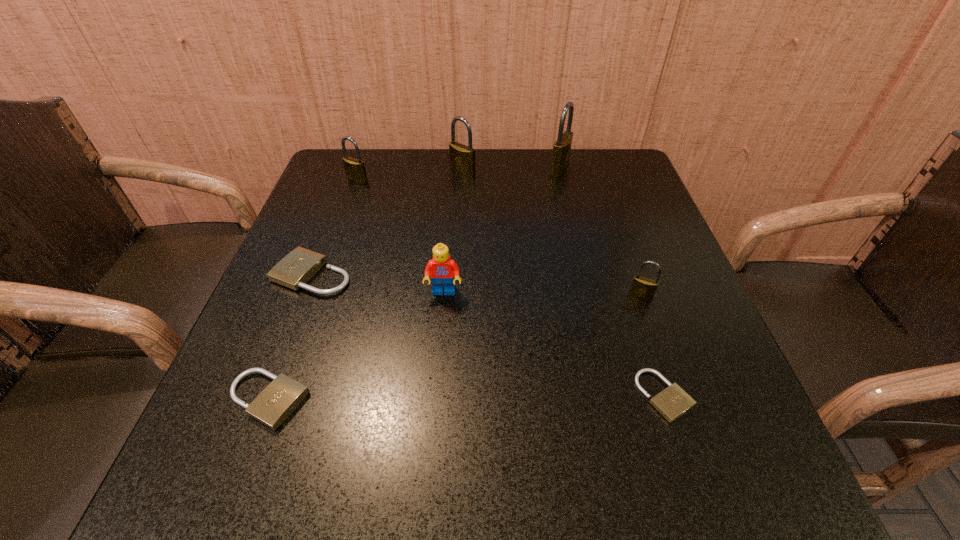
Identify the location of padlock that is the third nearest to the third brass padlock from left to right. This screenshot has width=960, height=540. point(355,170).

Point out which padlock is positioned as the fifth nearest to the smallest beige padlock. Please provide its 2D coordinates. Your answer should be formatted as a tuple, i.e. [(x, y)], where the tuple contains the x and y coordinates of a point satisfying the conditions above.

[(462, 158)]

Locate an element on the screen. Image resolution: width=960 pixels, height=540 pixels. brass padlock that is the second closest to the fourth tallest padlock is located at coordinates (462, 158).

Select which brass padlock is the third closest to the third biggest brass padlock. Please provide its 2D coordinates. Your answer should be formatted as a tuple, i.e. [(x, y)], where the tuple contains the x and y coordinates of a point satisfying the conditions above.

[(644, 288)]

Locate which beige padlock is the second closest to the Lego. Please provide its 2D coordinates. Your answer should be formatted as a tuple, i.e. [(x, y)], where the tuple contains the x and y coordinates of a point satisfying the conditions above.

[(281, 397)]

Identify which beige padlock is located as the second nearest to the Lego. Please provide its 2D coordinates. Your answer should be formatted as a tuple, i.e. [(x, y)], where the tuple contains the x and y coordinates of a point satisfying the conditions above.

[(281, 397)]

Where is `blank space that satisfies the following two spatial constraints: 1. on the front side of the shortest padlock; 2. on the right side of the leftmost brass padlock`? blank space that satisfies the following two spatial constraints: 1. on the front side of the shortest padlock; 2. on the right side of the leftmost brass padlock is located at coordinates (280, 396).